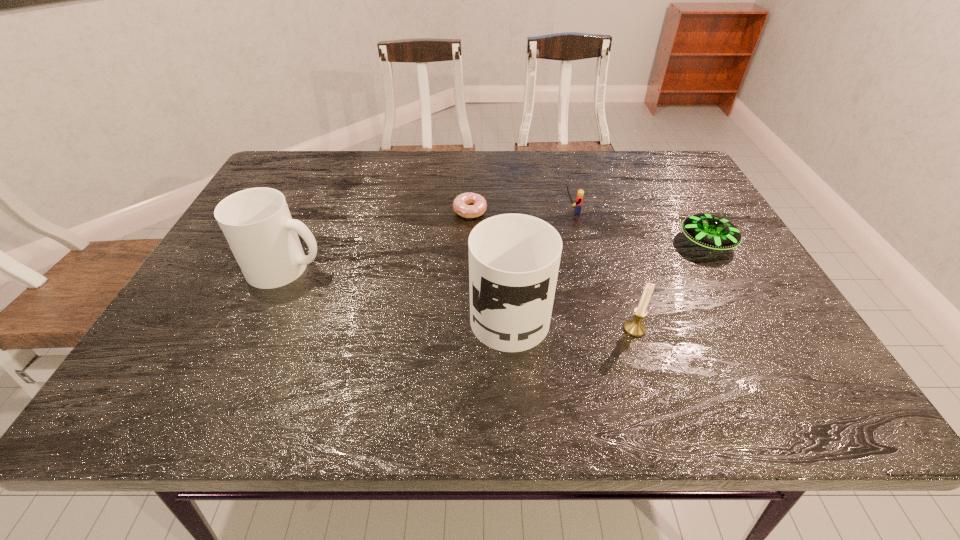
Find the location of a particular element. the third tallest object is located at coordinates (635, 327).

The image size is (960, 540). I want to click on vacant area located on the handle side of the left mug, so click(x=352, y=268).

Image resolution: width=960 pixels, height=540 pixels. What are the coordinates of `free space located 0.400m on the handle side of the right mug` in the screenshot? It's located at (501, 181).

Image resolution: width=960 pixels, height=540 pixels. I want to click on vacant space situated 0.310m on the handle side of the right mug, so click(x=502, y=198).

Where is `vacant point located on the handle side of the right mug`? The width and height of the screenshot is (960, 540). vacant point located on the handle side of the right mug is located at coordinates (502, 198).

You are a GUI agent. You are given a task and a screenshot of the screen. Output one action in this format:
    pyautogui.click(x=<x>, y=<y>)
    Task: Click on the free region located 0.330m on the front-facing side of the fourth tallest object
    This screenshot has height=540, width=960.
    Given the screenshot: What is the action you would take?
    pyautogui.click(x=441, y=211)

The image size is (960, 540). In order to click on vacant space located on the front-facing side of the fourth tallest object in this screenshot , I will do `click(473, 211)`.

Where is `vacant area situated 0.210m on the front-facing side of the fourth tallest object`? vacant area situated 0.210m on the front-facing side of the fourth tallest object is located at coordinates (485, 211).

Image resolution: width=960 pixels, height=540 pixels. Find the location of `vacant space situated 0.380m on the left of the shortest object`. vacant space situated 0.380m on the left of the shortest object is located at coordinates (314, 211).

The image size is (960, 540). In order to click on free space located 0.190m on the back of the second shortest object in this screenshot , I will do `click(674, 186)`.